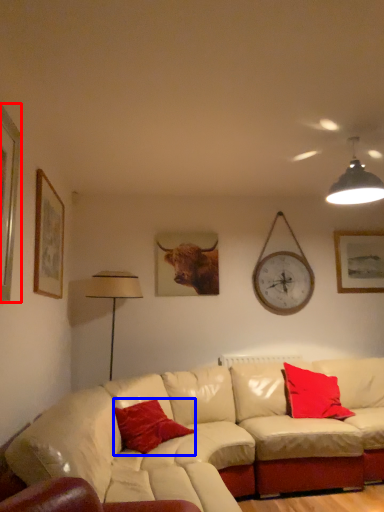
Question: Among these objects, which one is nearest to the camera, picture frame (highlighted by a red box) or pillow (highlighted by a blue box)?

Choices:
 (A) picture frame
 (B) pillow

Answer: (A)